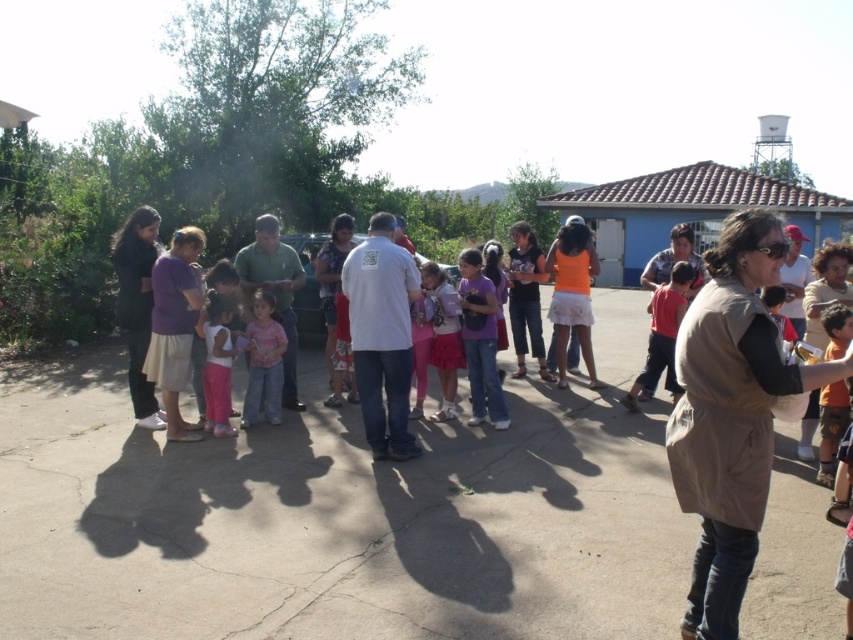
Question: Among these objects, which one is nearest to the camera?

Choices:
 (A) white matte shirt at center
 (B) pink fabric skirt at center

Answer: (A)

Question: Where is pink fabric dress at center located in relation to matte white shirt at center in the image?

Choices:
 (A) below
 (B) above

Answer: (A)

Question: Does pink cotton shirt at center have a smaller size compared to pink fabric dress at center?

Choices:
 (A) yes
 (B) no

Answer: (B)

Question: Can you confirm if black fabric jacket at left is positioned above matte white shirt at center?

Choices:
 (A) no
 (B) yes

Answer: (A)

Question: Which object is farther from the camera taking this photo?

Choices:
 (A) pink cotton shirt at center
 (B) pink fabric skirt at center
 (C) matte white shirt at center

Answer: (C)

Question: Which of the following is the farthest from the observer?

Choices:
 (A) pink fabric dress at center
 (B) orange cotton shirt at lower right

Answer: (A)